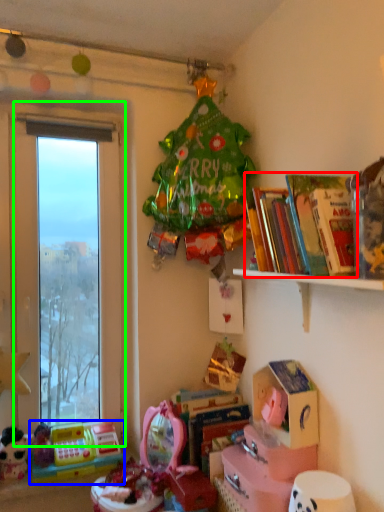
Question: Based on their relative distances, which object is farther from book (highlighted by a red box)? Choose from toy (highlighted by a blue box) and window (highlighted by a green box).

Choices:
 (A) toy
 (B) window

Answer: (A)